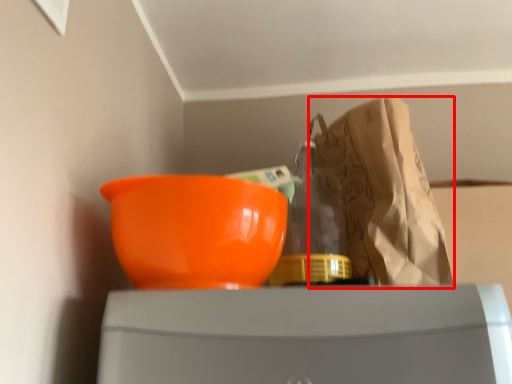
Question: In this image, where is grocery bag (annotated by the red box) located relative to bowl?

Choices:
 (A) right
 (B) left

Answer: (A)